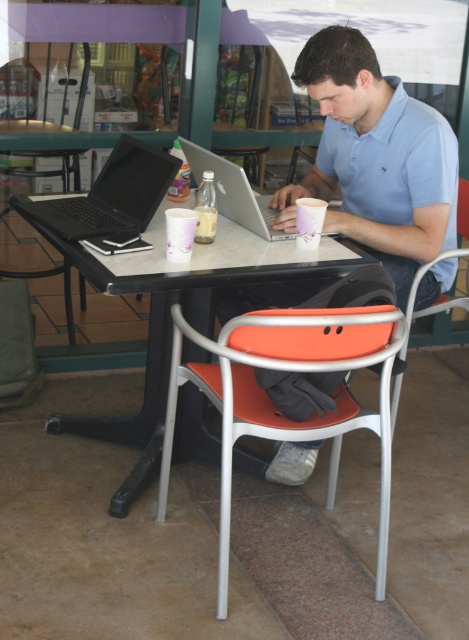
You are a photographer taking a picture of the light blue cotton shirt at upper center and the silver metallic laptop at center. Which object should you zoom in on to ensure both fit in the frame without cropping?

The light blue cotton shirt at upper center is wider than the silver metallic laptop at center, so you should zoom in on the silver metallic laptop at center to ensure both fit in the frame without cropping.

You are a person who wants to sit down at the orange matte chair at center. Can you see the matte black laptop at left from your seat?

The orange matte chair at center is below the matte black laptop at left, so when you sit down, the laptop will be positioned above you, making it easy to see and use.